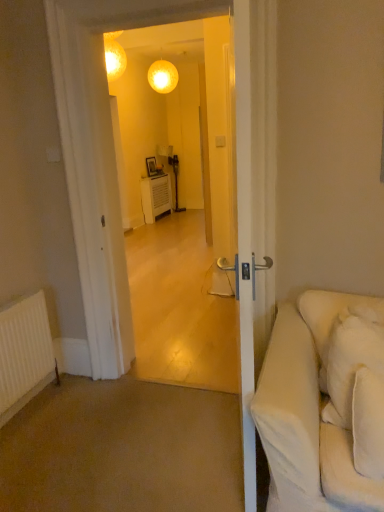
Question: Is transparent glass door at center taller than white soft pillow at right?

Choices:
 (A) no
 (B) yes

Answer: (B)

Question: Is transparent glass door at center positioned behind white soft pillow at right?

Choices:
 (A) no
 (B) yes

Answer: (B)

Question: From a real-world perspective, is transparent glass door at center on white soft pillow at right?

Choices:
 (A) yes
 (B) no

Answer: (A)

Question: From the image's perspective, does transparent glass door at center appear lower than white soft pillow at right?

Choices:
 (A) yes
 (B) no

Answer: (B)

Question: Is transparent glass door at center facing towards white soft pillow at right?

Choices:
 (A) yes
 (B) no

Answer: (B)

Question: In terms of width, does white soft pillow at right look wider or thinner when compared to transparent glass door at center?

Choices:
 (A) wide
 (B) thin

Answer: (B)

Question: Is white soft pillow at right in front of or behind transparent glass door at center in the image?

Choices:
 (A) front
 (B) behind

Answer: (A)

Question: Looking at the image, does white soft pillow at right seem bigger or smaller compared to transparent glass door at center?

Choices:
 (A) big
 (B) small

Answer: (B)

Question: From the image's perspective, is white soft pillow at right above or below transparent glass door at center?

Choices:
 (A) above
 (B) below

Answer: (B)

Question: Considering their positions, is transparent glass door at center located in front of or behind white matte radiator at lower left?

Choices:
 (A) front
 (B) behind

Answer: (A)

Question: Based on their positions, is transparent glass door at center located to the left or right of white matte radiator at lower left?

Choices:
 (A) right
 (B) left

Answer: (A)

Question: Is point (205, 331) positioned closer to the camera than point (13, 402)?

Choices:
 (A) closer
 (B) farther

Answer: (B)

Question: Choose the correct answer: Is transparent glass door at center inside white matte radiator at lower left or outside it?

Choices:
 (A) outside
 (B) inside

Answer: (A)

Question: Considering the positions of matte glass sphere at upper center and white soft pillow at right in the image, is matte glass sphere at upper center bigger or smaller than white soft pillow at right?

Choices:
 (A) small
 (B) big

Answer: (A)

Question: From the image's perspective, is matte glass sphere at upper center above or below white soft pillow at right?

Choices:
 (A) below
 (B) above

Answer: (B)